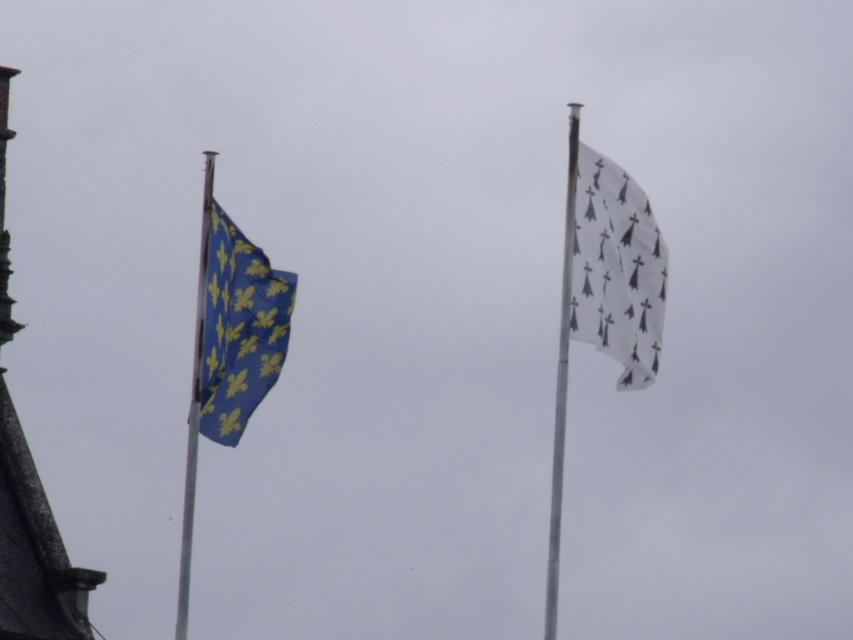
You are standing at the center of the image and want to walk to the smooth stone tower at left. In which direction should you go?

The smooth stone tower at left is located at point (33, 548), so you should walk to the left to reach it.

You are a photographer trying to capture both the white matte flag at upper right and the metallic silver flag pole at left in a single frame. Considering their sizes, which object will appear smaller in your photo?

The white matte flag at upper right is thinner than the metallic silver flag pole at left, so it will appear smaller in the photo.

You are a photographer trying to capture both the white matte flag at upper right and the rusty metal flag pole at right in a single shot. Based on their heights, which object will appear larger in the photo?

The white matte flag at upper right is not as tall as the rusty metal flag pole at right, so the rusty metal flag pole at right will appear larger in the photo.